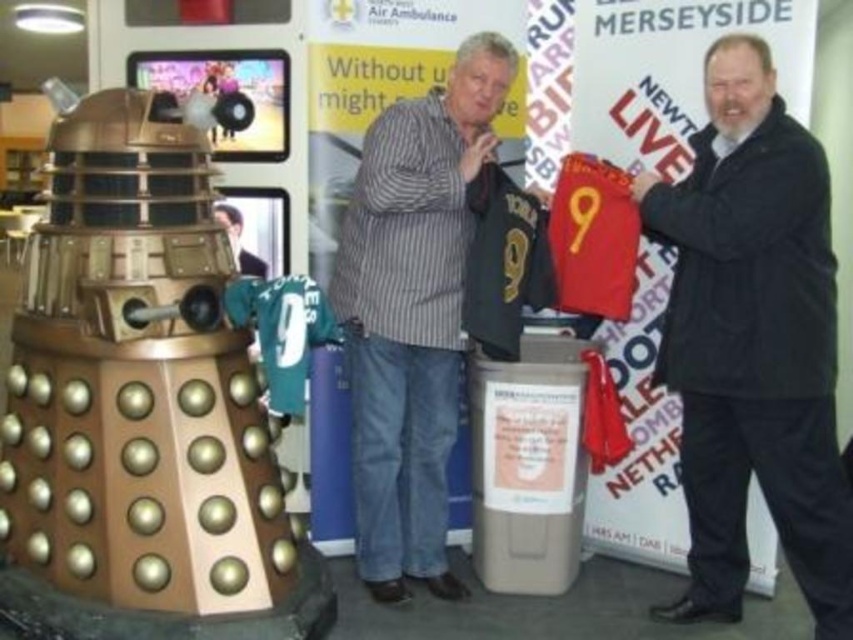
Does striped cotton shirt at center appear over smooth black shirt at center?

No, striped cotton shirt at center is not above smooth black shirt at center.

Is point (407, 260) behind point (236, 241)?

No, (407, 260) is in front of (236, 241).

The height and width of the screenshot is (640, 853). Identify the location of striped cotton shirt at center. (412, 312).

Does dark gray jacket at center come behind striped cotton shirt at center?

No.

Between dark gray jacket at center and striped cotton shirt at center, which one appears on the right side from the viewer's perspective?

Answer: From the viewer's perspective, dark gray jacket at center appears more on the right side.

Where is `dark gray jacket at center`? The height and width of the screenshot is (640, 853). dark gray jacket at center is located at coordinates (753, 342).

Find the location of a particular element. Image resolution: width=853 pixels, height=640 pixels. dark gray jacket at center is located at coordinates click(x=753, y=342).

Is dark gray jacket at center shorter than smooth black shirt at center?

No.

Which is more to the left, dark gray jacket at center or smooth black shirt at center?

smooth black shirt at center is more to the left.

Is point (720, 433) positioned before point (247, 268)?

That is True.

Identify the location of dark gray jacket at center. The width and height of the screenshot is (853, 640). (753, 342).